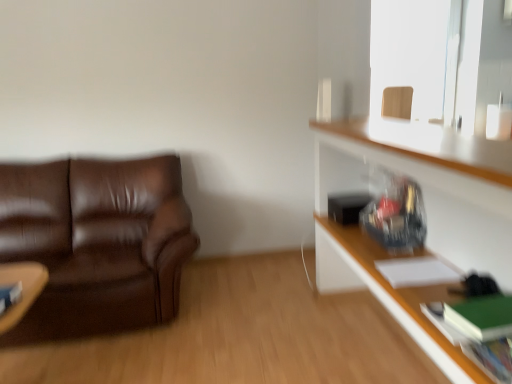
Question: Is wooden swivel chair at upper right to the right of hardcover book at lower left, the 1th book from the left, from the viewer's perspective?

Choices:
 (A) yes
 (B) no

Answer: (A)

Question: Can you confirm if wooden swivel chair at upper right is smaller than hardcover book at lower left, the 1th book from the left?

Choices:
 (A) no
 (B) yes

Answer: (A)

Question: Is wooden swivel chair at upper right shorter than hardcover book at lower left, which is the second book from back to front?

Choices:
 (A) yes
 (B) no

Answer: (B)

Question: From the image's perspective, is wooden swivel chair at upper right under hardcover book at lower left, the 1th book from the left?

Choices:
 (A) yes
 (B) no

Answer: (B)

Question: Is wooden swivel chair at upper right taller than hardcover book at lower left, the fourth book from the right?

Choices:
 (A) yes
 (B) no

Answer: (A)

Question: Is wooden swivel chair at upper right far from hardcover book at lower left, which is the second book from back to front?

Choices:
 (A) yes
 (B) no

Answer: (A)

Question: From the image's perspective, is brown leather couch at left on top of hardcover book at lower right, the 4th book from the back?

Choices:
 (A) yes
 (B) no

Answer: (A)

Question: Is brown leather couch at left facing towards hardcover book at lower right, the 4th book from the back?

Choices:
 (A) no
 (B) yes

Answer: (A)

Question: Can you confirm if brown leather couch at left is shorter than hardcover book at lower right, the 4th book from the back?

Choices:
 (A) yes
 (B) no

Answer: (B)

Question: Is brown leather couch at left positioned in front of hardcover book at lower right, the 1th book viewed from the right?

Choices:
 (A) yes
 (B) no

Answer: (B)

Question: Is brown leather couch at left thinner than hardcover book at lower right, the 1th book viewed from the right?

Choices:
 (A) yes
 (B) no

Answer: (B)

Question: Is brown leather couch at left not inside hardcover book at lower right, the 1th book viewed from the right?

Choices:
 (A) yes
 (B) no

Answer: (A)

Question: Can you confirm if wooden frame at upper right is bigger than white paper at upper right, which is counted as the 4th book, starting from the front?

Choices:
 (A) no
 (B) yes

Answer: (B)